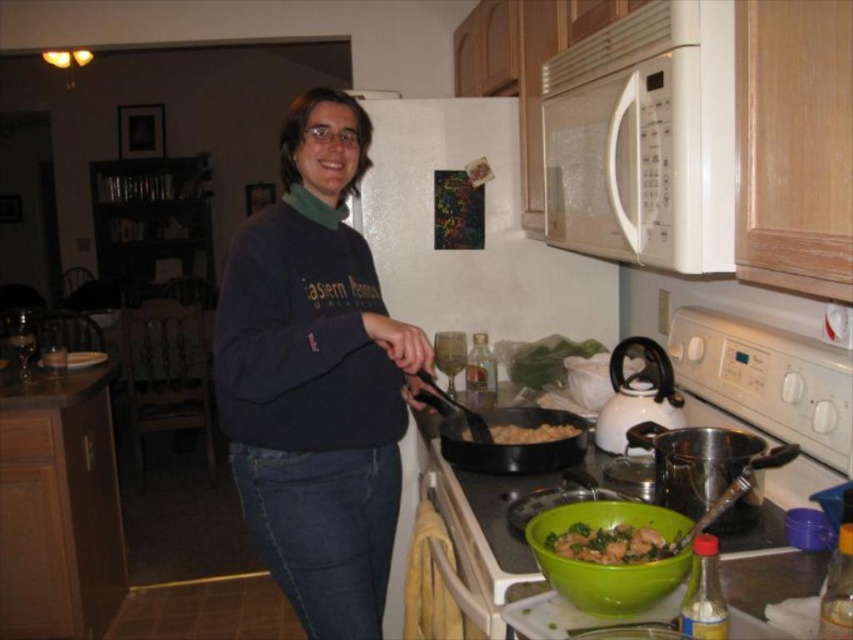
You are preparing to serve food from the green matte bowl at lower center into the brown matte pan at center. Will the bowl fit entirely inside the pan?

The green matte bowl at lower center is smaller than the brown matte pan at center, so yes, the bowl will fit entirely inside the pan.

Looking at this image, please describe the object located at the coordinates point (514, 444) in the kitchen scene.

The object at point (514, 444) is a black matte wok located at the center of the scene.